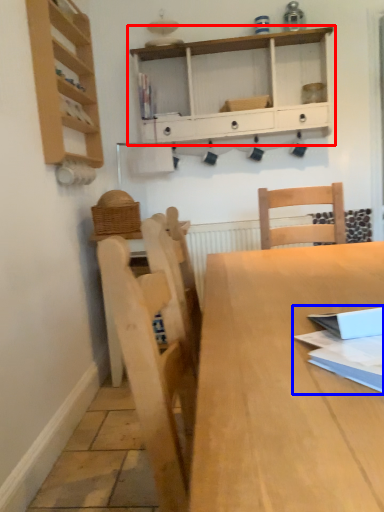
Question: Among these objects, which one is nearest to the camera, shelf (highlighted by a red box) or book (highlighted by a blue box)?

Choices:
 (A) shelf
 (B) book

Answer: (B)